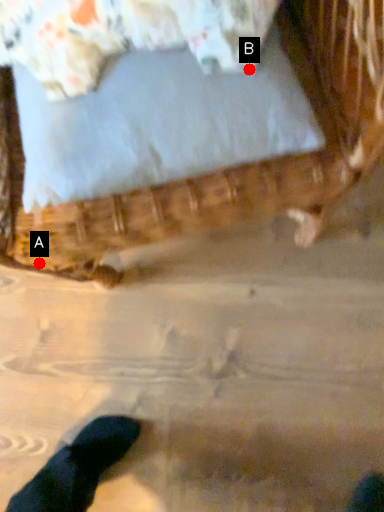
Question: Two points are circled on the image, labeled by A and B beside each circle. Which point is farther to the camera?

Choices:
 (A) A is further
 (B) B is further

Answer: (A)